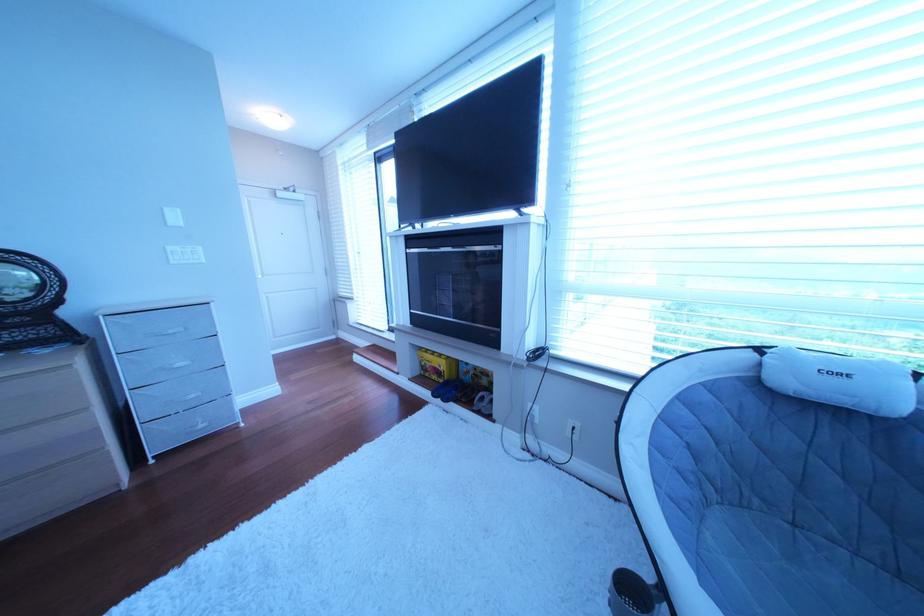
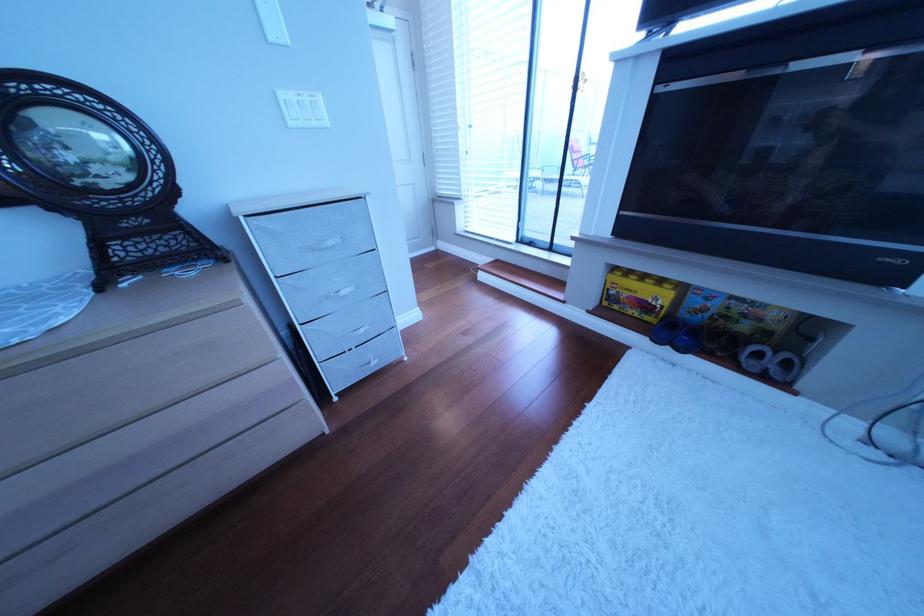
Find the pixel in the second image that matches pixel 188 264 in the first image.

(307, 126)